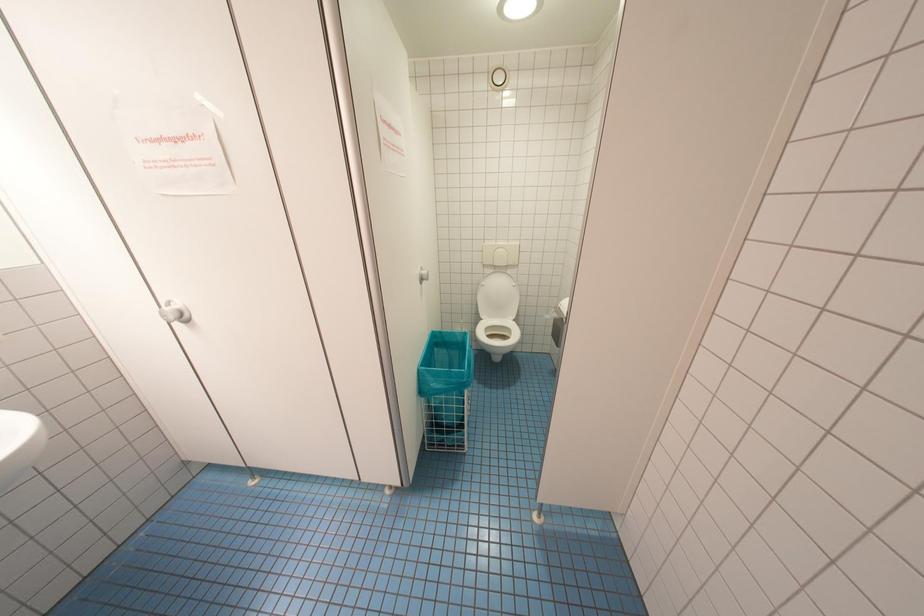
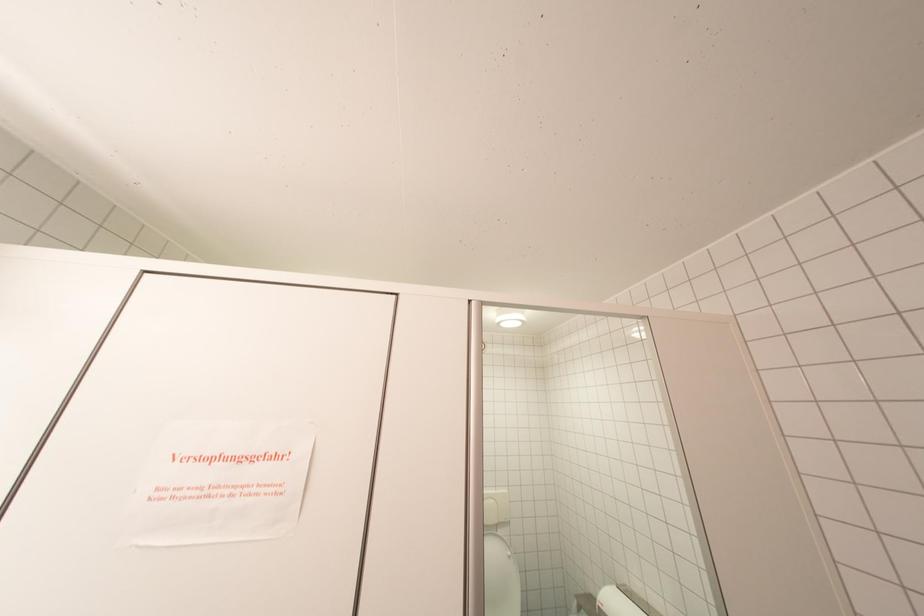
The images are taken continuously from a first-person perspective. In which direction is your viewpoint rotating?

The camera rotated toward right-up.